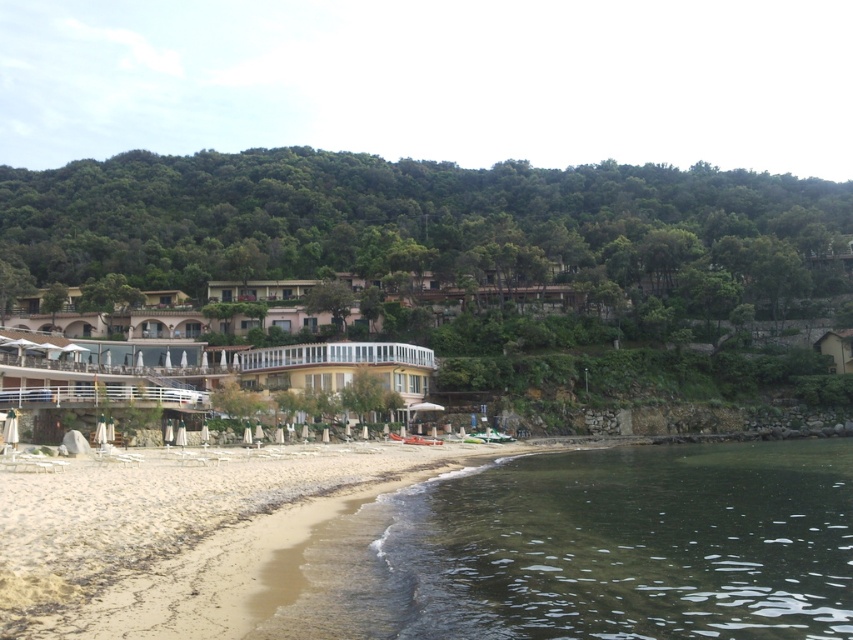
Does green leafy hillside at upper center appear on the left side of white glass hotel at center?

Indeed, green leafy hillside at upper center is positioned on the left side of white glass hotel at center.

Is point (509, 209) positioned behind point (335, 348)?

Yes, it is.

You are a GUI agent. You are given a task and a screenshot of the screen. Output one action in this format:
    pyautogui.click(x=<x>, y=<y>)
    Task: Click on the green leafy hillside at upper center
    The width and height of the screenshot is (853, 640).
    Given the screenshot: What is the action you would take?
    pyautogui.click(x=376, y=211)

Does clear water at lower right lie in front of green leafy hillside at upper center?

Yes, clear water at lower right is in front of green leafy hillside at upper center.

Is clear water at lower right further to camera compared to green leafy hillside at upper center?

No.

Is point (833, 624) positioned in front of point (717, 225)?

That is True.

Where is `clear water at lower right`? The width and height of the screenshot is (853, 640). clear water at lower right is located at coordinates (630, 545).

Does green leafy hillside at upper center come in front of light brown sand at lower left?

No, it is behind light brown sand at lower left.

Is green leafy hillside at upper center above light brown sand at lower left?

Indeed, green leafy hillside at upper center is positioned over light brown sand at lower left.

Identify the location of green leafy hillside at upper center. (376, 211).